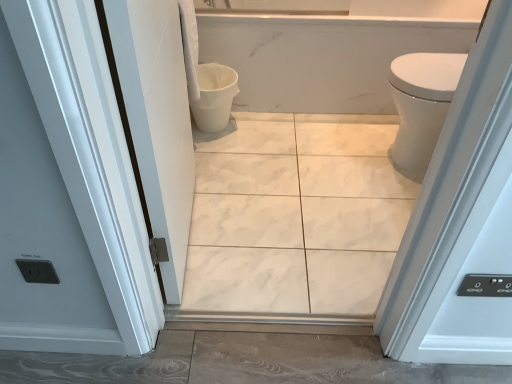
Question: Is white marble tile at center situated inside white glossy door at left or outside?

Choices:
 (A) outside
 (B) inside

Answer: (A)

Question: From the image's perspective, is white marble tile at center above or below white glossy door at left?

Choices:
 (A) below
 (B) above

Answer: (A)

Question: Based on their relative distances, which object is nearer to the white glossy door at left?

Choices:
 (A) white marble tile at center
 (B) white glossy bidet at right
 (C) white matte toilet bowl at center

Answer: (A)

Question: Which object is positioned farthest from the white glossy bidet at right?

Choices:
 (A) white matte toilet bowl at center
 (B) white marble tile at center
 (C) white glossy door at left

Answer: (C)